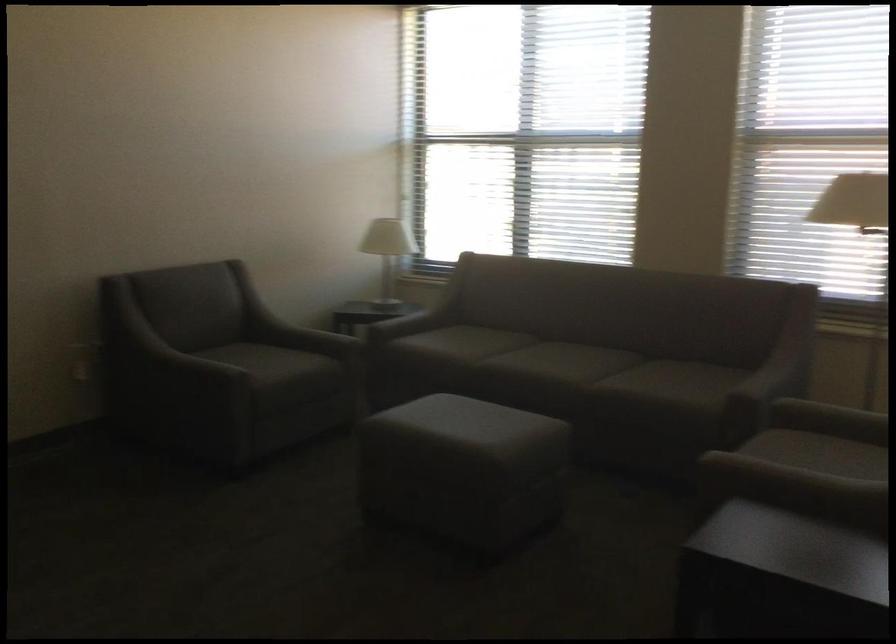
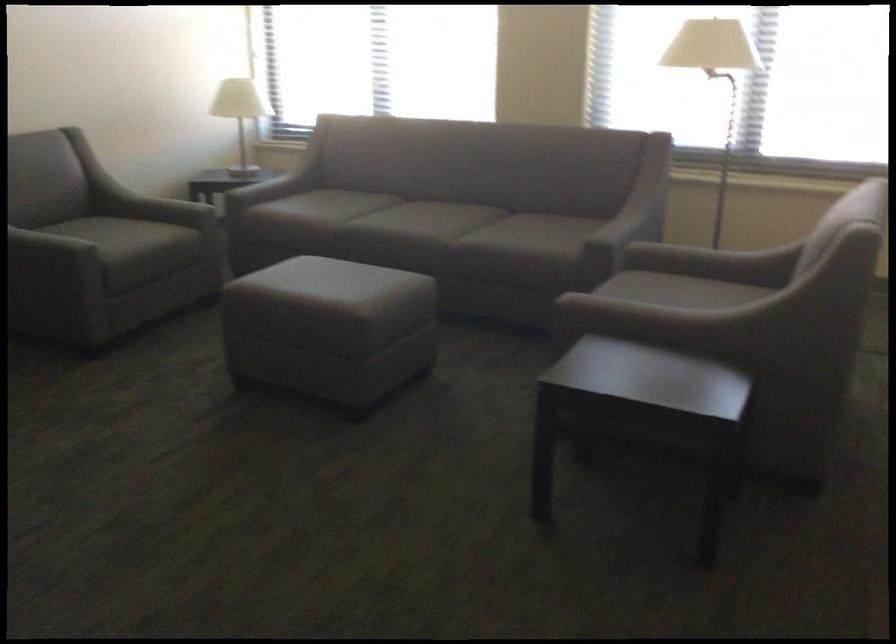
Question: Which direction would the cameraman need to move to produce the second image? Reply with the corresponding letter.

Choices:
 (A) Left
 (B) Right
 (C) Forward
 (D) Backward

Answer: (B)